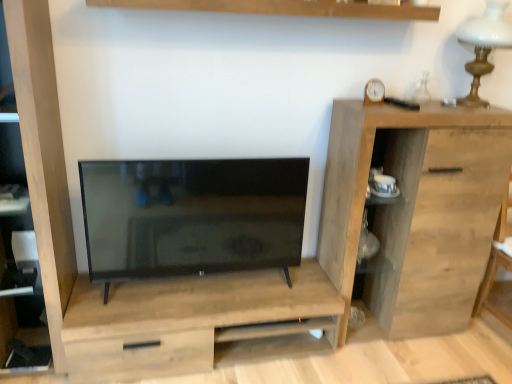
Question: Does natural wood cabinet at right have a lesser height compared to wooden shelf at upper center?

Choices:
 (A) no
 (B) yes

Answer: (A)

Question: Is natural wood cabinet at right to the right of wooden shelf at upper center from the viewer's perspective?

Choices:
 (A) yes
 (B) no

Answer: (A)

Question: Would you say wooden shelf at upper center is part of natural wood cabinet at right's contents?

Choices:
 (A) yes
 (B) no

Answer: (B)

Question: Is natural wood cabinet at right facing towards wooden shelf at upper center?

Choices:
 (A) yes
 (B) no

Answer: (B)

Question: Does natural wood cabinet at right have a lesser width compared to wooden shelf at upper center?

Choices:
 (A) yes
 (B) no

Answer: (B)

Question: In terms of width, does wooden clock at upper right look wider or thinner when compared to wooden shelf at upper center?

Choices:
 (A) thin
 (B) wide

Answer: (A)

Question: Considering the positions of point (368, 86) and point (306, 4), is point (368, 86) closer or farther from the camera than point (306, 4)?

Choices:
 (A) farther
 (B) closer

Answer: (A)

Question: Is wooden clock at upper right bigger or smaller than wooden shelf at upper center?

Choices:
 (A) big
 (B) small

Answer: (B)

Question: From a real-world perspective, is wooden clock at upper right physically located above or below wooden shelf at upper center?

Choices:
 (A) below
 (B) above

Answer: (A)

Question: Is wooden shelf at upper center inside or outside of light wood dresser at center?

Choices:
 (A) inside
 (B) outside

Answer: (B)

Question: From the image's perspective, is wooden shelf at upper center positioned above or below light wood dresser at center?

Choices:
 (A) below
 (B) above

Answer: (B)

Question: Considering their positions, is wooden shelf at upper center located in front of or behind light wood dresser at center?

Choices:
 (A) front
 (B) behind

Answer: (A)

Question: Considering the relative positions of wooden shelf at upper center and light wood dresser at center in the image provided, is wooden shelf at upper center to the left or to the right of light wood dresser at center?

Choices:
 (A) right
 (B) left

Answer: (A)

Question: From a real-world perspective, is matte black tv at center positioned above or below light wood dresser at center?

Choices:
 (A) above
 (B) below

Answer: (A)

Question: From the image's perspective, is matte black tv at center above or below light wood dresser at center?

Choices:
 (A) below
 (B) above

Answer: (B)